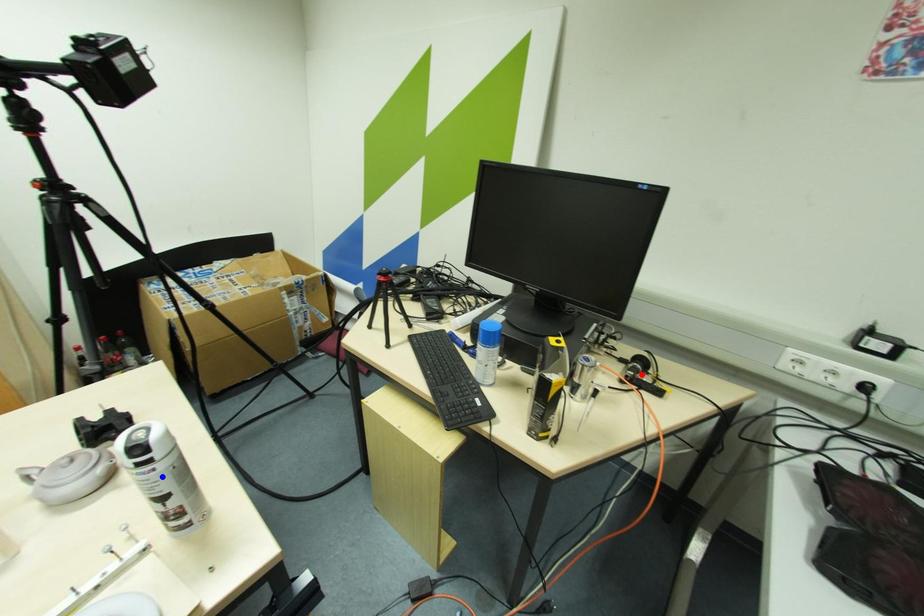
Question: Two points are marked on the image. Which point is closer to the camera?

Choices:
 (A) Blue point is closer.
 (B) Red point is closer.

Answer: (A)